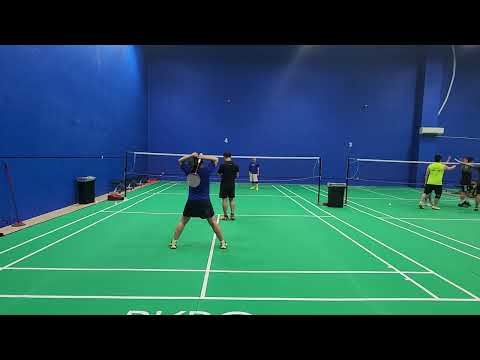
Find the location of `cable`. cable is located at coordinates (454, 69).